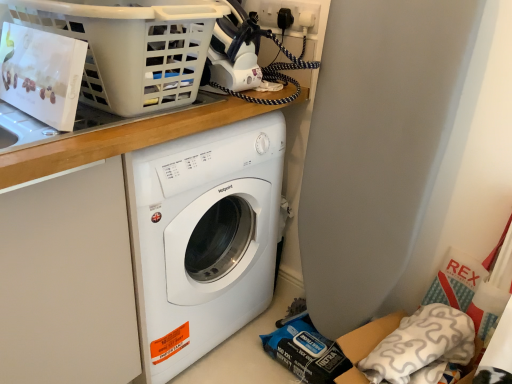
Question: Considering the relative positions of wooden at upper center and white plastic basket at upper left in the image provided, is wooden at upper center to the left or to the right of white plastic basket at upper left?

Choices:
 (A) right
 (B) left

Answer: (A)

Question: From the image's perspective, is wooden at upper center above or below white plastic basket at upper left?

Choices:
 (A) below
 (B) above

Answer: (A)

Question: Which of these objects is positioned farthest from the black plastic plug at upper right?

Choices:
 (A) wooden at upper center
 (B) white plastic basket at upper left
 (C) white soft pillow at lower right

Answer: (C)

Question: Considering the real-world distances, which object is farthest from the white soft pillow at lower right?

Choices:
 (A) wooden at upper center
 (B) white plastic basket at upper left
 (C) black plastic plug at upper right

Answer: (C)